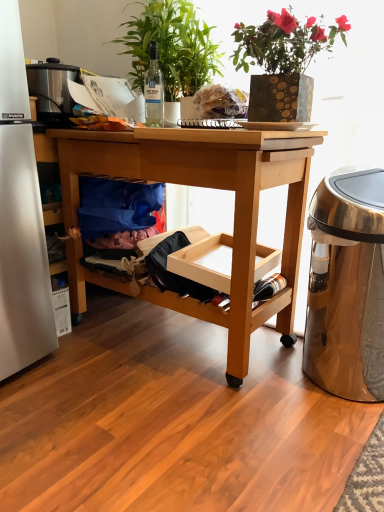
Question: In the image, is blue fabric bag at lower left on the left side or the right side of gold-patterned pot at upper center, the second houseplant in the left-to-right sequence?

Choices:
 (A) right
 (B) left

Answer: (B)

Question: Is blue fabric bag at lower left taller or shorter than gold-patterned pot at upper center, the second houseplant in the left-to-right sequence?

Choices:
 (A) short
 (B) tall

Answer: (A)

Question: Which object is the farthest from the translucent glass bottle at lower right, the first bottle when ordered from bottom to top?

Choices:
 (A) green leafy plant at upper center, the second houseplant in the right-to-left sequence
 (B) shiny metallic trash can at right
 (C) blue fabric bag at lower left
 (D) gold-patterned pot at upper center, the second houseplant in the left-to-right sequence
 (E) natural wood desk at center

Answer: (A)

Question: Estimate the real-world distances between objects in this image. Which object is closer to the green leafy plant at upper center, which is counted as the 1th houseplant, starting from the left?

Choices:
 (A) natural wood desk at center
 (B) shiny metallic trash can at right
 (C) gold-patterned pot at upper center, the second houseplant in the left-to-right sequence
 (D) clear glass bottle at center, the first bottle in the top-to-bottom sequence
 (E) blue fabric bag at lower left

Answer: (D)